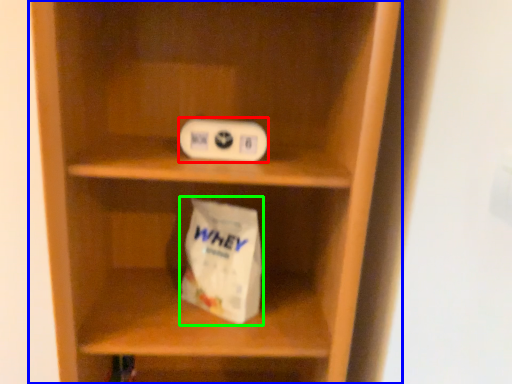
Question: Which object is the farthest from ipod (highlighted by a red box)? Choose among these: shelf (highlighted by a blue box) or paper bag (highlighted by a green box).

Choices:
 (A) shelf
 (B) paper bag

Answer: (A)